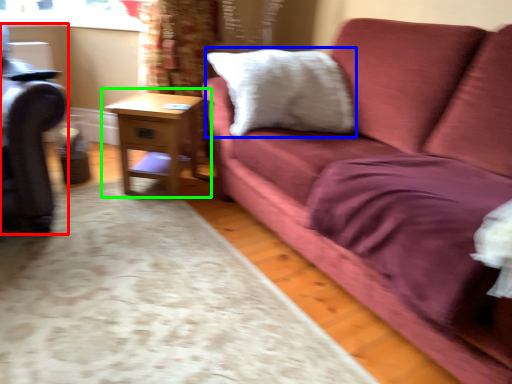
Question: Considering the real-world distances, which object is farthest from swivel chair (highlighted by a red box)? pillow (highlighted by a blue box) or table (highlighted by a green box)?

Choices:
 (A) pillow
 (B) table

Answer: (A)